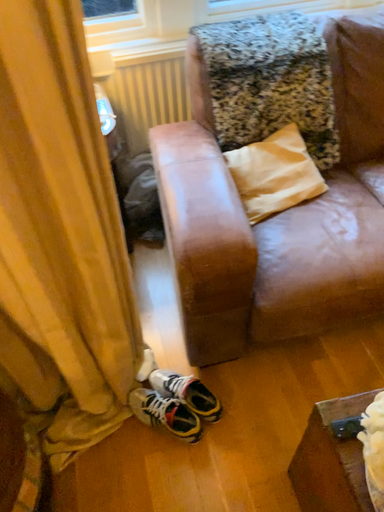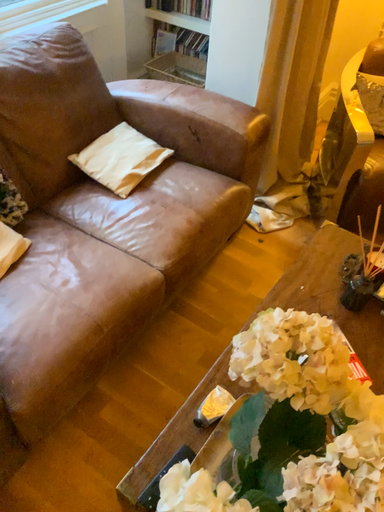
Question: How did the camera likely rotate when shooting the video?

Choices:
 (A) rotated downward
 (B) rotated upward

Answer: (B)